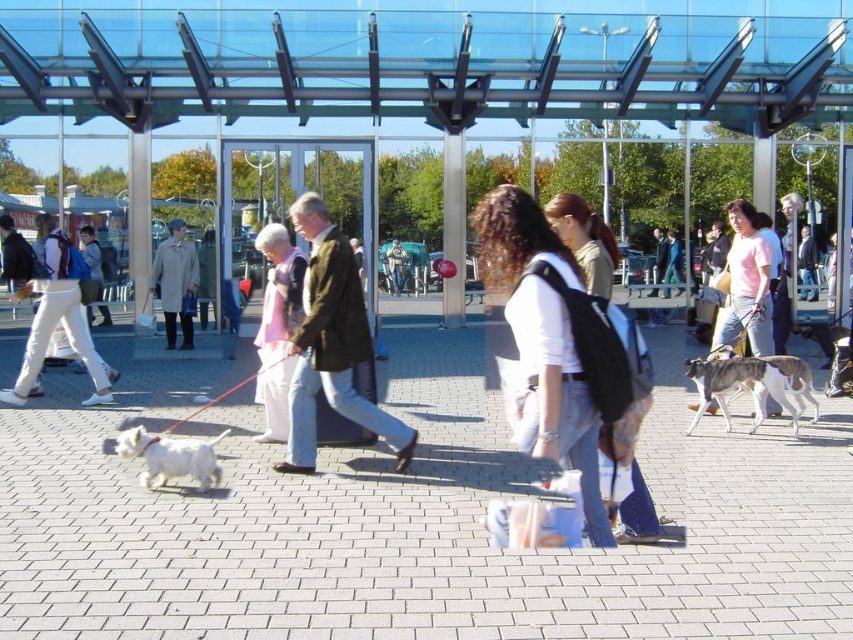
You are standing at the entrance of the station and see the green textured jacket at center. Can you determine its exact location in the scene using the coordinate system provided?

The green textured jacket at center is located at point coordinates (332, 344).

You are a person who wants to carry both the white matte backpack at center and the green textured jacket at center. Since you have a limited space on your shoulder, which one can you carry without taking up too much width?

The white matte backpack at center is thinner than the green textured jacket at center, so you can carry the white matte backpack at center first as it takes up less width.